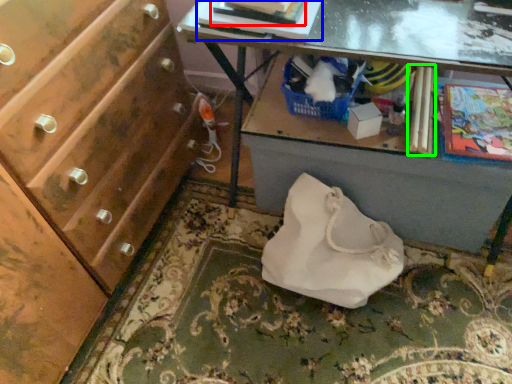
Question: Estimate the real-world distances between objects in this image. Which object is closer to magazine (highlighted by a red box), book (highlighted by a blue box) or magazine (highlighted by a green box)?

Choices:
 (A) book
 (B) magazine

Answer: (A)